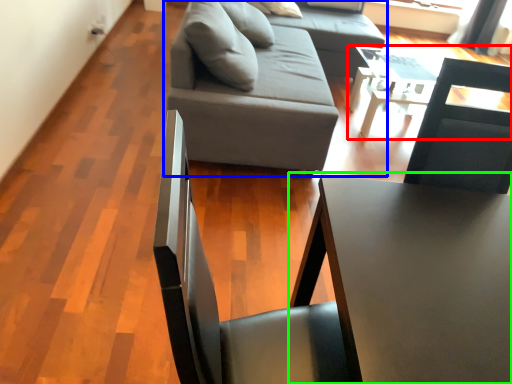
Question: Which object is the farthest from table (highlighted by a red box)? Choose among these: studio couch (highlighted by a blue box) or table (highlighted by a green box).

Choices:
 (A) studio couch
 (B) table

Answer: (B)